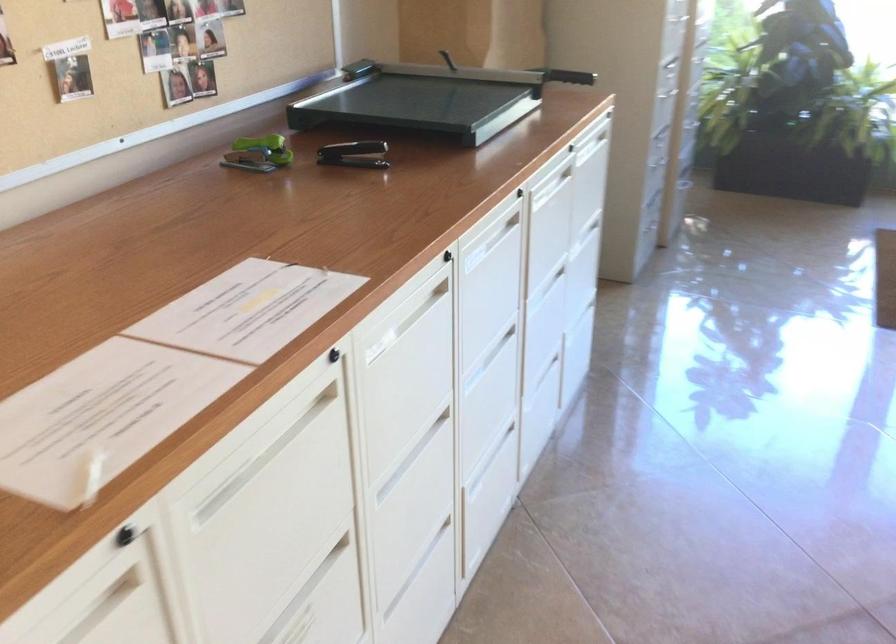
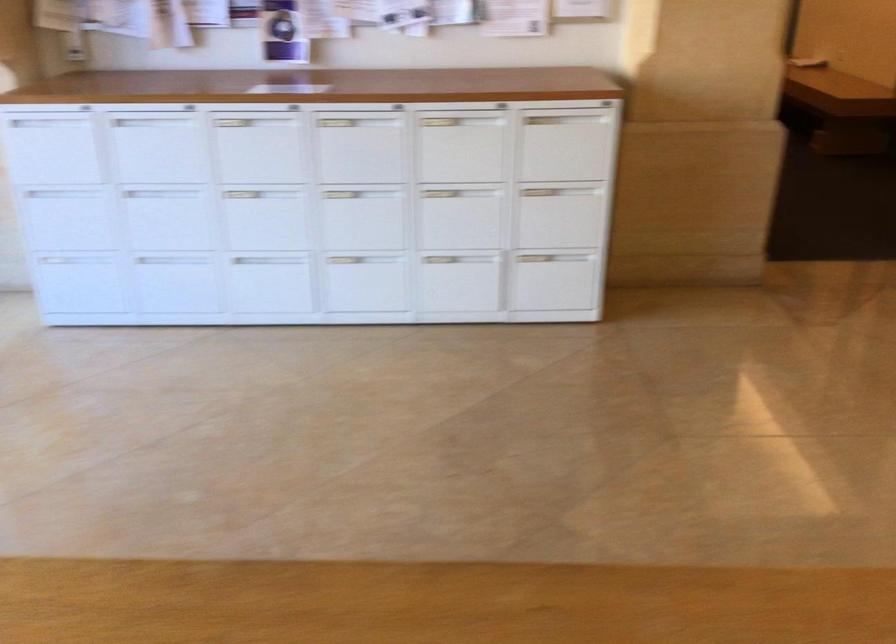
Looking at this image, how did the camera likely rotate?

The rotation direction of the camera is right-down.